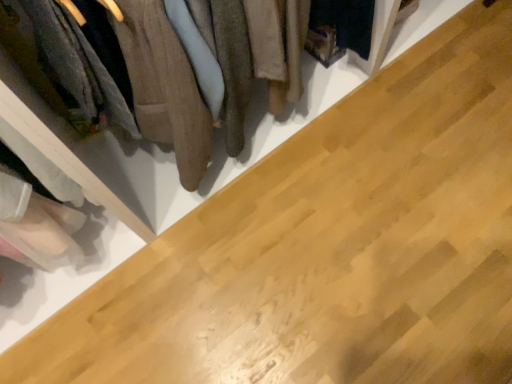
What do you see at coordinates (129, 83) in the screenshot?
I see `wooden hangers at upper left` at bounding box center [129, 83].

In order to face wooden hangers at upper left, should I rotate leftwards or rightwards?

Rotate your view left by about 5.860°.

At what (x,y) coordinates should I click in order to perform the action: click on wooden hangers at upper left. Please return your answer as a coordinate pair (x, y). Looking at the image, I should click on (129, 83).

Find the location of a particular element. Image resolution: width=512 pixels, height=384 pixels. wooden hangers at upper left is located at coordinates (129, 83).